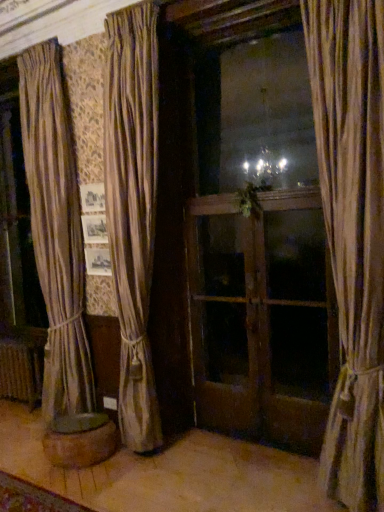
This screenshot has width=384, height=512. I want to click on vacant area that is situated to the right of brown wood stool at lower left, so click(x=146, y=461).